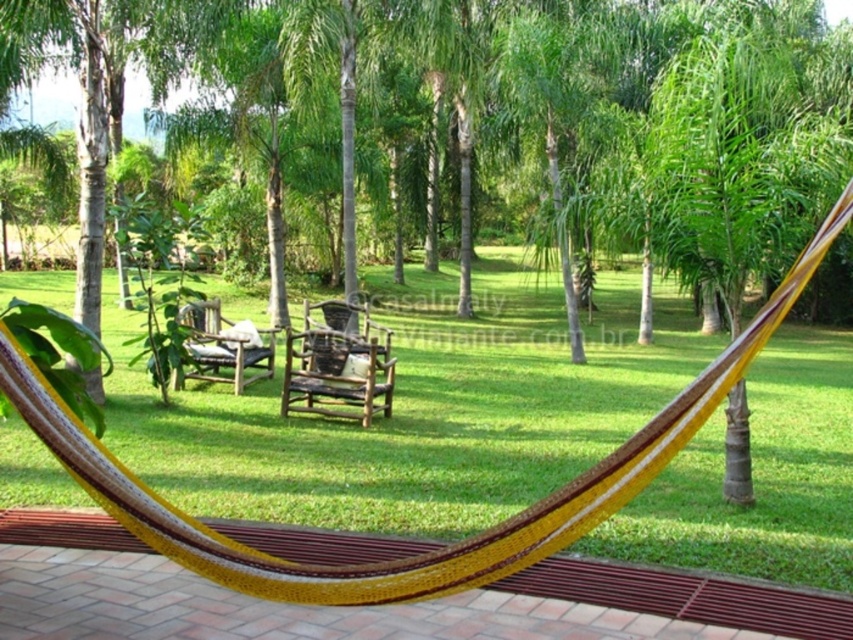
You are planning to set up a small picnic area in the garden and need to place both the brown woven park bench at center and the wooden park bench at center. Since space is limited, which bench should you choose to place first to ensure both fit comfortably?

The brown woven park bench at center occupies less space than the wooden park bench at center, so you should place the wooden park bench at center first to ensure both fit comfortably by allowing more room for the larger one.

You are planning to set up a small picnic in the garden. You have two benches available. Which bench should you choose if you want to accommodate more people? Please refer to the brown woven park bench at center and the wooden park bench at center.

The brown woven park bench at center has a larger width than the wooden park bench at center, so it can accommodate more people.